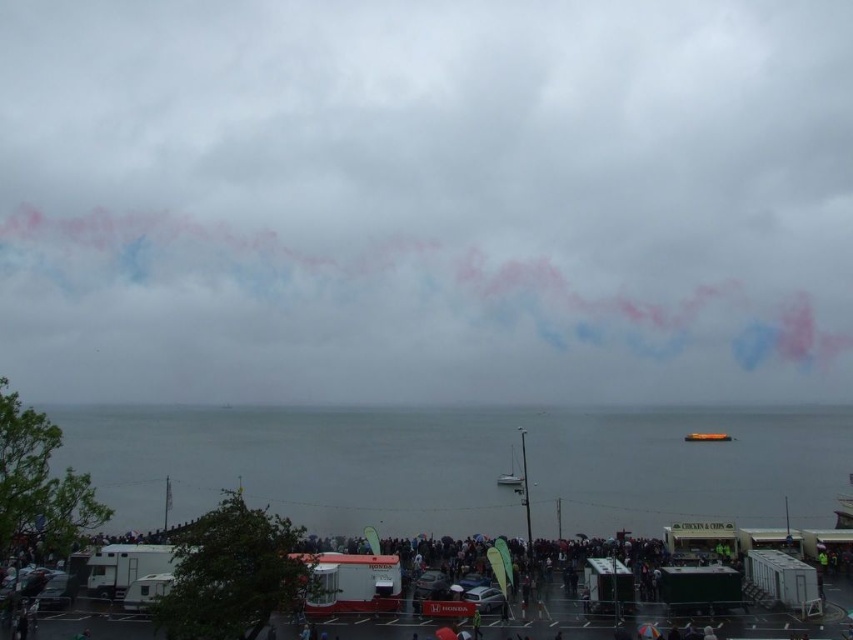
Which is behind, point (22, 140) or point (810, 515)?

The point (22, 140) is more distant.

Who is more distant from viewer, (698,58) or (142,477)?

The point (698,58) is behind.

The image size is (853, 640). In order to click on pink smoke at upper center in this screenshot , I will do `click(426, 200)`.